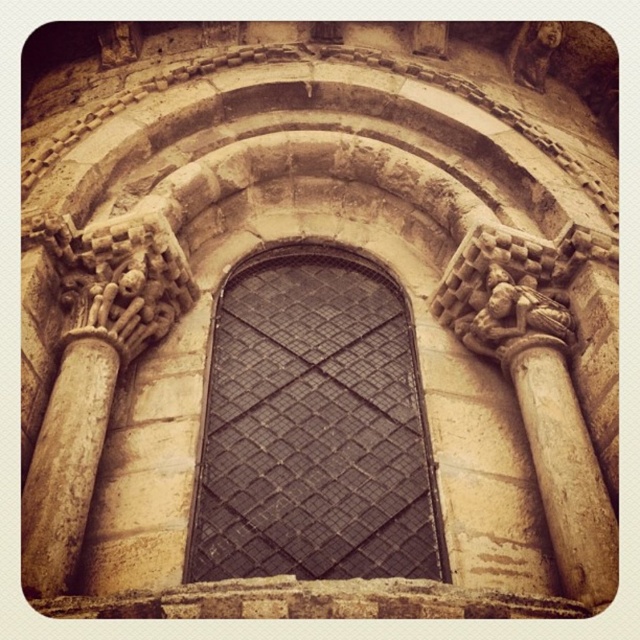
Is black metal grid at center taller than beige stone column at right?

Yes.

Does black metal grid at center have a lesser width compared to beige stone column at right?

No, black metal grid at center is not thinner than beige stone column at right.

Describe the element at coordinates (314, 426) in the screenshot. Image resolution: width=640 pixels, height=640 pixels. I see `black metal grid at center` at that location.

What are the coordinates of `black metal grid at center` in the screenshot? It's located at (314, 426).